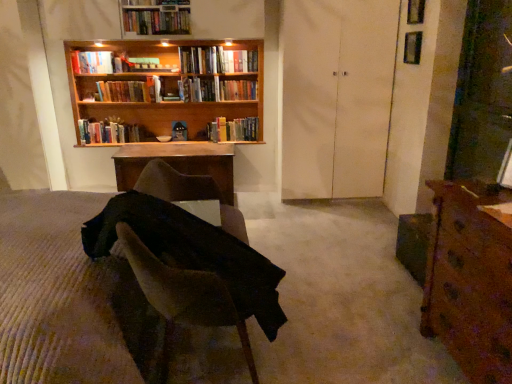
Identify the location of clear glass window at upper right, which is the 1th window from bottom to top. This screenshot has width=512, height=384. (x=412, y=48).

How much space does hardcover books at upper left, the second book when ordered from bottom to top, occupy horizontally?

hardcover books at upper left, the second book when ordered from bottom to top, is 7.59 inches in width.

Where is `brown fabric chair at center`? This screenshot has width=512, height=384. brown fabric chair at center is located at coordinates (184, 296).

In order to click on brown corduroy bed at lower left in this screenshot , I will do pos(67,298).

The image size is (512, 384). What do you see at coordinates (415, 11) in the screenshot? I see `transparent glass window at upper right, positioned as the first window in top-to-bottom order` at bounding box center [415, 11].

Locate an element on the screen. clear glass window at upper right, arranged as the 2th window when viewed from the top is located at coordinates (412, 48).

Is hardcover books at upper center, which appears as the 7th book when ordered from the bottom, bigger or smaller than wooden desk at center?

hardcover books at upper center, which appears as the 7th book when ordered from the bottom, is smaller than wooden desk at center.

Is there a large distance between hardcover books at upper center, which appears as the 7th book when ordered from the bottom, and wooden desk at center?

Yes, hardcover books at upper center, which appears as the 7th book when ordered from the bottom, and wooden desk at center are quite far apart.

Is hardcover books at upper center, which appears as the 7th book when ordered from the bottom, wider than wooden desk at center?

No, hardcover books at upper center, which appears as the 7th book when ordered from the bottom, is not wider than wooden desk at center.

What's the angular difference between hardcover books at upper center, which appears as the 7th book when ordered from the bottom, and wooden desk at center's facing directions?

0.00264 degrees separate the facing orientations of hardcover books at upper center, which appears as the 7th book when ordered from the bottom, and wooden desk at center.

Does hardcover books at center, which ranks as the 5th book in bottom-to-top order, come in front of hardcover books at upper left, which ranks as the sixth book in top-to-bottom order?

Yes.

From the image's perspective, which one is positioned lower, hardcover books at center, arranged as the third book when viewed from the top, or hardcover books at upper left, which ranks as the sixth book in top-to-bottom order?

hardcover books at upper left, which ranks as the sixth book in top-to-bottom order.

From a real-world perspective, is hardcover books at center, which ranks as the 5th book in bottom-to-top order, positioned under hardcover books at upper left, the second book when ordered from bottom to top, based on gravity?

No, from a real-world perspective, hardcover books at center, which ranks as the 5th book in bottom-to-top order, is not below hardcover books at upper left, the second book when ordered from bottom to top.

Based on their sizes in the image, would you say hardcover books at center, acting as the 7th book starting from the top, is bigger or smaller than brown wood desk at right?

hardcover books at center, acting as the 7th book starting from the top, is smaller than brown wood desk at right.

Is brown wood desk at right a part of hardcover books at center, acting as the 7th book starting from the top?

No, brown wood desk at right is located outside of hardcover books at center, acting as the 7th book starting from the top.

Is hardcover books at center, which is the 1th book in bottom-to-top order, facing towards brown wood desk at right?

No, hardcover books at center, which is the 1th book in bottom-to-top order, is not aimed at brown wood desk at right.

From the image's perspective, starting from the brown wood desk at right, which book is the 1st one above? Please provide its 2D coordinates.

[(106, 132)]

At what (x,y) coordinates should I click in order to perform the action: click on the 6th book to the right of the hardcover book at upper left, acting as the fourth book starting from the top, counting from the anchor's position. Please return your answer as a coordinate pair (x, y). Looking at the image, I should click on (238, 61).

Looking at this image, who is smaller, hardcover book at upper center, which ranks as the sixth book in bottom-to-top order, or hardcover book at upper left, the 4th book when ordered from bottom to top?

hardcover book at upper center, which ranks as the sixth book in bottom-to-top order, is smaller.

From the image's perspective, is hardcover book at upper center, placed as the second book when sorted from top to bottom, positioned above or below hardcover book at upper left, the 4th book when ordered from bottom to top?

hardcover book at upper center, placed as the second book when sorted from top to bottom, is above hardcover book at upper left, the 4th book when ordered from bottom to top.

From a real-world perspective, between hardcover book at upper center, which ranks as the sixth book in bottom-to-top order, and hardcover book at upper left, acting as the fourth book starting from the top, who is vertically higher?

hardcover book at upper left, acting as the fourth book starting from the top, from a real-world perspective.

Is the surface of brown wood desk at right in direct contact with hardcover books at center, which is the 1th book in bottom-to-top order?

No, brown wood desk at right is not touching hardcover books at center, which is the 1th book in bottom-to-top order.

From a real-world perspective, does brown wood desk at right sit lower than hardcover books at center, which is the 1th book in bottom-to-top order?

Correct, in the physical world, brown wood desk at right is lower than hardcover books at center, which is the 1th book in bottom-to-top order.

Who is bigger, brown wood desk at right or hardcover books at center, acting as the 7th book starting from the top?

Bigger between the two is brown wood desk at right.

Looking at this image, in the image, is wooden bookshelf at upper center positioned in front of or behind hardcover books at center, which is the 1th book in bottom-to-top order?

Visually, wooden bookshelf at upper center is located in front of hardcover books at center, which is the 1th book in bottom-to-top order.

Which is closer to the camera, (245, 131) or (81, 119)?

Point (245, 131) is farther from the camera than point (81, 119).

From a real-world perspective, between wooden bookshelf at upper center and hardcover books at center, which is the 1th book in bottom-to-top order, who is vertically lower?

hardcover books at center, which is the 1th book in bottom-to-top order, is physically lower.

Between wooden bookshelf at upper center and hardcover books at center, which is the 1th book in bottom-to-top order, which one has larger size?

Bigger between the two is wooden bookshelf at upper center.

Is clear glass window at upper right, arranged as the 2th window when viewed from the top, closer to camera compared to hardcover book at upper left, acting as the fourth book starting from the top?

Yes, clear glass window at upper right, arranged as the 2th window when viewed from the top, is in front of hardcover book at upper left, acting as the fourth book starting from the top.

Can we say clear glass window at upper right, which is the 1th window from bottom to top, lies outside hardcover book at upper left, the 4th book when ordered from bottom to top?

Absolutely, clear glass window at upper right, which is the 1th window from bottom to top, is external to hardcover book at upper left, the 4th book when ordered from bottom to top.

Considering the relative sizes of clear glass window at upper right, which is the 1th window from bottom to top, and hardcover book at upper left, the 4th book when ordered from bottom to top, in the image provided, is clear glass window at upper right, which is the 1th window from bottom to top, wider than hardcover book at upper left, the 4th book when ordered from bottom to top,?

In fact, clear glass window at upper right, which is the 1th window from bottom to top, might be narrower than hardcover book at upper left, the 4th book when ordered from bottom to top.

I want to click on book in front of the wooden desk at center, so click(x=156, y=21).

Identify the location of the 3rd book above the hardcover books at upper left, which ranks as the sixth book in top-to-bottom order (from a real-world perspective). The image size is (512, 384). (200, 60).

Considering their positions, is hardcover books at upper center, the 1th book from the top, positioned further to brown corduroy bed at lower left than hardcover books at upper left, which ranks as the sixth book in top-to-bottom order?

The object further to brown corduroy bed at lower left is hardcover books at upper left, which ranks as the sixth book in top-to-bottom order.

When comparing their distances from clear glass window at upper right, which is the 1th window from bottom to top, does hardcover books at upper center, which appears as the 7th book when ordered from the bottom, or white matte door at center seem further?

Among the two, hardcover books at upper center, which appears as the 7th book when ordered from the bottom, is located further to clear glass window at upper right, which is the 1th window from bottom to top.

When comparing their distances from white matte door at center, does hardcover books at center, which is counted as the fifth book, starting from the top, or transparent glass window at upper right, which appears as the second window when ordered from the bottom, seem closer?

The object closer to white matte door at center is hardcover books at center, which is counted as the fifth book, starting from the top.

Which object lies nearer to the anchor point brown corduroy bed at lower left, hardcover books at center, which ranks as the 5th book in bottom-to-top order, or hardcover books at upper center, the 1th book from the top?

The object closer to brown corduroy bed at lower left is hardcover books at upper center, the 1th book from the top.

Considering their positions, is hardcover books at center, which is the 1th book in bottom-to-top order, positioned closer to transparent glass window at upper right, positioned as the first window in top-to-bottom order, than hardcover books at center, which ranks as the 5th book in bottom-to-top order?

Based on the image, hardcover books at center, which ranks as the 5th book in bottom-to-top order, appears to be nearer to transparent glass window at upper right, positioned as the first window in top-to-bottom order.

Estimate the real-world distances between objects in this image. Which object is closer to brown fabric chair at center, hardcover books at center, which ranks as the 5th book in bottom-to-top order, or wooden bookshelf at upper center?

wooden bookshelf at upper center is positioned closer to the anchor brown fabric chair at center.

Considering their positions, is hardcover book at upper center, placed as the second book when sorted from top to bottom, positioned closer to wooden desk at center than brown wood desk at right?

The object closer to wooden desk at center is hardcover book at upper center, placed as the second book when sorted from top to bottom.

From the image, which object appears to be farther from hardcover books at center, arranged as the third book when viewed from the top, transparent glass window at upper right, positioned as the first window in top-to-bottom order, or brown fabric chair at center?

brown fabric chair at center lies further to hardcover books at center, arranged as the third book when viewed from the top, than the other object.

This screenshot has height=384, width=512. Identify the location of glass door located between brown corduroy bed at lower left and wooden bookshelf at upper center in the depth direction. (336, 96).

Identify the location of bookcase between brown corduroy bed at lower left and hardcover books at center, which ranks as the 5th book in bottom-to-top order, along the z-axis. Image resolution: width=512 pixels, height=384 pixels. (163, 94).

In order to click on chair between brown corduroy bed at lower left and hardcover book at upper center, which ranks as the sixth book in bottom-to-top order, in the front-back direction in this screenshot , I will do `click(184, 296)`.

This screenshot has width=512, height=384. I want to click on book between brown fabric chair at center and wooden desk at center from front to back, so click(x=156, y=21).